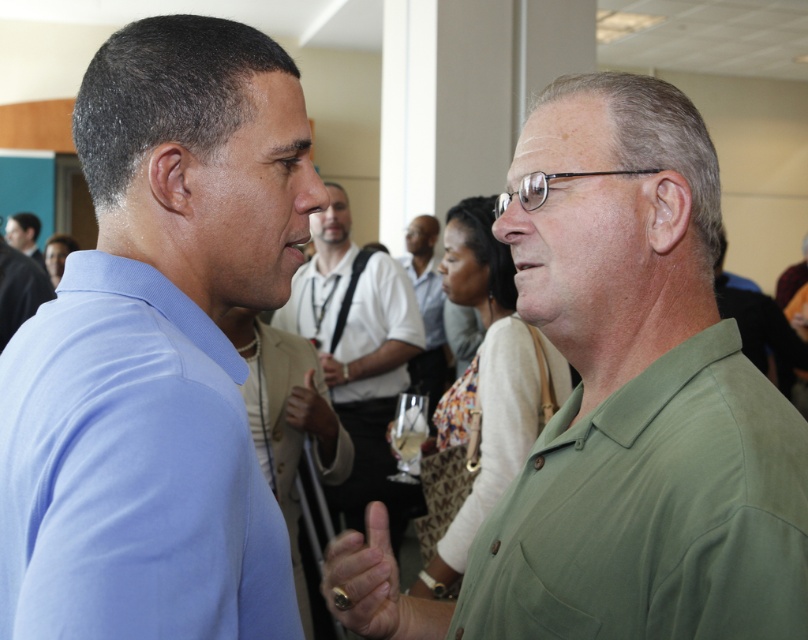
Question: Where is gold ring at center located in relation to matte blue shirt at left in the image?

Choices:
 (A) below
 (B) above

Answer: (A)

Question: Can you confirm if light blue shirt at left is positioned to the left of matte blue shirt at center?

Choices:
 (A) yes
 (B) no

Answer: (B)

Question: Estimate the real-world distances between objects in this image. Which object is closer to the light blue shirt at left?

Choices:
 (A) matte green shirt at center
 (B) matte blue shirt at center

Answer: (B)

Question: Does matte blue shirt at center have a greater width compared to matte blue shirt at left?

Choices:
 (A) yes
 (B) no

Answer: (A)

Question: Among these points, which one is farthest from the camera?

Choices:
 (A) (390, 397)
 (B) (22, 243)

Answer: (B)

Question: Which point is closer to the camera taking this photo?

Choices:
 (A) (373, 476)
 (B) (405, 596)

Answer: (B)